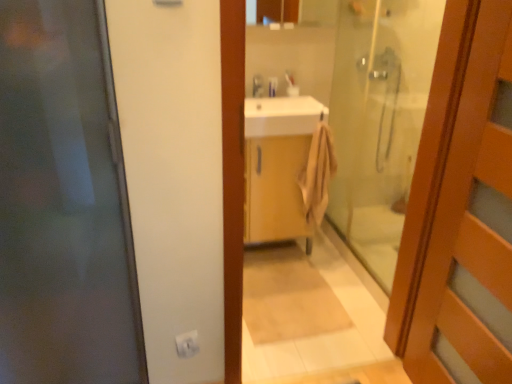
Question: Considering the relative sizes of wooden cabinet at center and transparent glass shower door at center in the image provided, is wooden cabinet at center thinner than transparent glass shower door at center?

Choices:
 (A) yes
 (B) no

Answer: (B)

Question: Can transparent glass shower door at center be found inside wooden cabinet at center?

Choices:
 (A) no
 (B) yes

Answer: (A)

Question: Is wooden cabinet at center located outside transparent glass shower door at center?

Choices:
 (A) no
 (B) yes

Answer: (B)

Question: From the image's perspective, is wooden cabinet at center under transparent glass shower door at center?

Choices:
 (A) no
 (B) yes

Answer: (B)

Question: From the image's perspective, is wooden cabinet at center on transparent glass shower door at center?

Choices:
 (A) no
 (B) yes

Answer: (A)

Question: Is wooden cabinet at center oriented towards transparent glass shower door at center?

Choices:
 (A) no
 (B) yes

Answer: (A)

Question: Is transparent glass shower door at center to the right of white plastic toothbrush at center, the first toiletry in the left-to-right sequence, from the viewer's perspective?

Choices:
 (A) yes
 (B) no

Answer: (A)

Question: Can you confirm if transparent glass shower door at center is bigger than white plastic toothbrush at center, marked as the second toiletry in a right-to-left arrangement?

Choices:
 (A) no
 (B) yes

Answer: (B)

Question: Can you confirm if transparent glass shower door at center is wider than white plastic toothbrush at center, marked as the second toiletry in a right-to-left arrangement?

Choices:
 (A) yes
 (B) no

Answer: (B)

Question: Is transparent glass shower door at center oriented towards white plastic toothbrush at center, the first toiletry in the left-to-right sequence?

Choices:
 (A) no
 (B) yes

Answer: (B)

Question: Is transparent glass shower door at center to the left of white plastic toothbrush at center, the first toiletry in the left-to-right sequence, from the viewer's perspective?

Choices:
 (A) no
 (B) yes

Answer: (A)

Question: Is transparent glass shower door at center far from white plastic toothbrush at center, marked as the second toiletry in a right-to-left arrangement?

Choices:
 (A) yes
 (B) no

Answer: (B)

Question: Considering the relative positions of matte silver faucet at upper center and transparent glass door at left, the 1th door when ordered from left to right, in the image provided, is matte silver faucet at upper center to the right of transparent glass door at left, the 1th door when ordered from left to right, from the viewer's perspective?

Choices:
 (A) yes
 (B) no

Answer: (A)